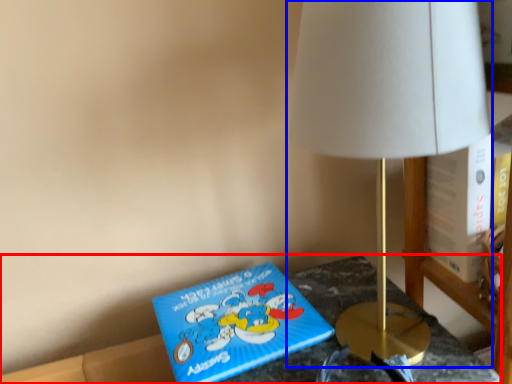
Question: Among these objects, which one is farthest to the camera, furniture (highlighted by a red box) or lamp (highlighted by a blue box)?

Choices:
 (A) furniture
 (B) lamp

Answer: (A)